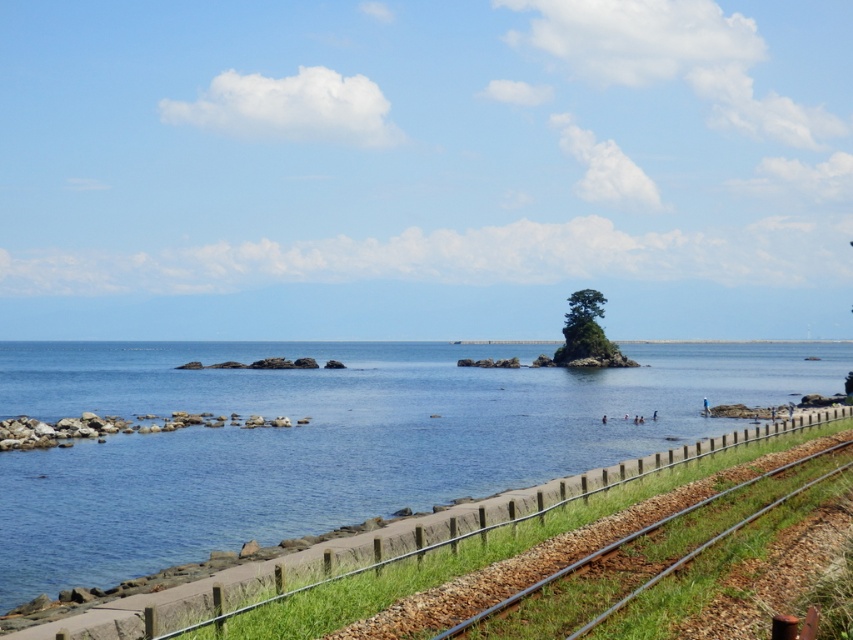
Question: Among these objects, which one is nearest to the camera?

Choices:
 (A) metallic rail at lower right
 (B) clear blue water at center

Answer: (A)

Question: Which object is farther from the camera taking this photo?

Choices:
 (A) metallic rail at lower right
 (B) clear blue water at center

Answer: (B)

Question: Does clear blue water at center lie behind metallic rail at lower right?

Choices:
 (A) yes
 (B) no

Answer: (A)

Question: From the image, what is the correct spatial relationship of clear blue water at center in relation to metallic rail at lower right?

Choices:
 (A) left
 (B) right

Answer: (B)

Question: Does clear blue water at center appear on the right side of metallic rail at lower right?

Choices:
 (A) no
 (B) yes

Answer: (B)